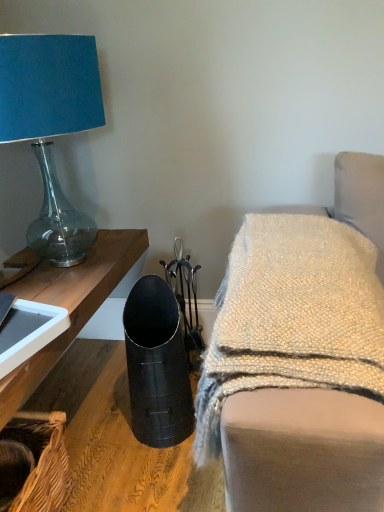
Question: From the image's perspective, would you say woven brown basket at lower left is positioned over matte blue fabric lampshade at upper left?

Choices:
 (A) no
 (B) yes

Answer: (A)

Question: Is woven brown basket at lower left positioned with its back to matte blue fabric lampshade at upper left?

Choices:
 (A) yes
 (B) no

Answer: (B)

Question: Is woven brown basket at lower left oriented towards matte blue fabric lampshade at upper left?

Choices:
 (A) no
 (B) yes

Answer: (A)

Question: Considering the relative sizes of woven brown basket at lower left and matte blue fabric lampshade at upper left in the image provided, is woven brown basket at lower left thinner than matte blue fabric lampshade at upper left?

Choices:
 (A) yes
 (B) no

Answer: (A)

Question: From the image's perspective, is woven brown basket at lower left below matte blue fabric lampshade at upper left?

Choices:
 (A) no
 (B) yes

Answer: (B)

Question: Considering the relative positions of woven brown basket at lower left and matte blue fabric lampshade at upper left in the image provided, is woven brown basket at lower left to the left of matte blue fabric lampshade at upper left from the viewer's perspective?

Choices:
 (A) no
 (B) yes

Answer: (B)

Question: Does metallic black vase at lower left have a lesser height compared to matte blue fabric lampshade at upper left?

Choices:
 (A) yes
 (B) no

Answer: (A)

Question: Can you confirm if metallic black vase at lower left is taller than matte blue fabric lampshade at upper left?

Choices:
 (A) yes
 (B) no

Answer: (B)

Question: Is the depth of metallic black vase at lower left greater than that of matte blue fabric lampshade at upper left?

Choices:
 (A) no
 (B) yes

Answer: (A)

Question: Is matte blue fabric lampshade at upper left inside metallic black vase at lower left?

Choices:
 (A) yes
 (B) no

Answer: (B)

Question: Is metallic black vase at lower left closer to the viewer compared to matte blue fabric lampshade at upper left?

Choices:
 (A) no
 (B) yes

Answer: (B)

Question: From a real-world perspective, is metallic black vase at lower left over matte blue fabric lampshade at upper left?

Choices:
 (A) no
 (B) yes

Answer: (A)

Question: Can you confirm if metallic black vase at lower left is smaller than woven brown basket at lower left?

Choices:
 (A) yes
 (B) no

Answer: (B)